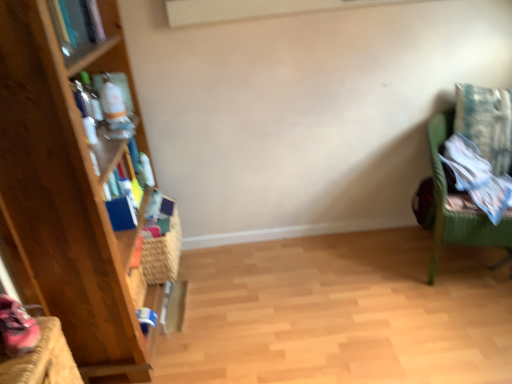
Question: Is woven straw basket at left shorter than green wicker chair at right?

Choices:
 (A) yes
 (B) no

Answer: (A)

Question: Can green wicker chair at right be found inside woven straw basket at left?

Choices:
 (A) no
 (B) yes

Answer: (A)

Question: From a real-world perspective, is woven straw basket at left positioned under green wicker chair at right based on gravity?

Choices:
 (A) yes
 (B) no

Answer: (A)

Question: From a real-world perspective, is woven straw basket at left physically above green wicker chair at right?

Choices:
 (A) no
 (B) yes

Answer: (A)

Question: Is woven straw basket at left placed right next to green wicker chair at right?

Choices:
 (A) yes
 (B) no

Answer: (B)

Question: Looking at their shapes, would you say matte blue book at upper left is wider or thinner than green wicker chair at right?

Choices:
 (A) thin
 (B) wide

Answer: (A)

Question: From a real-world perspective, relative to green wicker chair at right, is matte blue book at upper left vertically above or below?

Choices:
 (A) below
 (B) above

Answer: (B)

Question: Is matte blue book at upper left inside the boundaries of green wicker chair at right, or outside?

Choices:
 (A) inside
 (B) outside

Answer: (B)

Question: Is point (62, 1) closer or farther from the camera than point (467, 221)?

Choices:
 (A) farther
 (B) closer

Answer: (B)

Question: Is woven straw basket at left in front of or behind matte blue book at upper left in the image?

Choices:
 (A) front
 (B) behind

Answer: (B)

Question: Looking at the image, does woven straw basket at left seem bigger or smaller compared to matte blue book at upper left?

Choices:
 (A) big
 (B) small

Answer: (A)

Question: Looking at their shapes, would you say woven straw basket at left is wider or thinner than matte blue book at upper left?

Choices:
 (A) thin
 (B) wide

Answer: (B)

Question: Considering the relative positions of woven straw basket at left and matte blue book at upper left in the image provided, is woven straw basket at left to the left or to the right of matte blue book at upper left?

Choices:
 (A) left
 (B) right

Answer: (B)

Question: Considering the positions of wooden bookcase at left and woven straw basket at left in the image, is wooden bookcase at left taller or shorter than woven straw basket at left?

Choices:
 (A) tall
 (B) short

Answer: (A)

Question: Is wooden bookcase at left in front of or behind woven straw basket at left in the image?

Choices:
 (A) front
 (B) behind

Answer: (A)